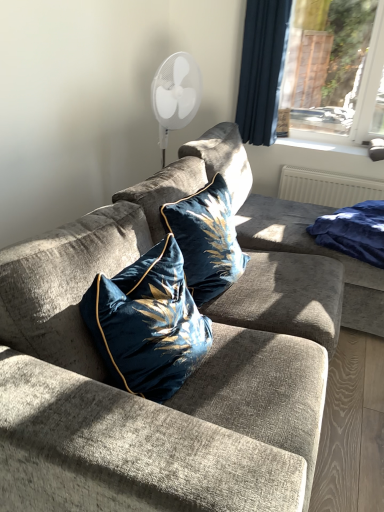
Question: Is blue velvet blanket at right shorter than velvet blue pillow at center, positioned as the 2th pillow in back-to-front order?

Choices:
 (A) no
 (B) yes

Answer: (B)

Question: Is blue velvet blanket at right positioned far away from velvet blue pillow at center, arranged as the 1th pillow when viewed from the front?

Choices:
 (A) yes
 (B) no

Answer: (A)

Question: Is blue velvet blanket at right facing away from velvet blue pillow at center, positioned as the 2th pillow in back-to-front order?

Choices:
 (A) yes
 (B) no

Answer: (B)

Question: Is blue velvet blanket at right with velvet blue pillow at center, arranged as the 1th pillow when viewed from the front?

Choices:
 (A) no
 (B) yes

Answer: (A)

Question: Considering the relative sizes of blue velvet blanket at right and velvet blue pillow at center, arranged as the 1th pillow when viewed from the front, in the image provided, is blue velvet blanket at right bigger than velvet blue pillow at center, arranged as the 1th pillow when viewed from the front,?

Choices:
 (A) no
 (B) yes

Answer: (A)

Question: From the image's perspective, does blue velvet blanket at right appear higher than velvet blue pillow at center, arranged as the 1th pillow when viewed from the front?

Choices:
 (A) no
 (B) yes

Answer: (B)

Question: Is white plastic window sill at upper right directly adjacent to velvet blue pillow at center, which is counted as the 1th pillow, starting from the back?

Choices:
 (A) yes
 (B) no

Answer: (B)

Question: Is velvet blue pillow at center, which is counted as the 1th pillow, starting from the back, completely or partially inside white plastic window sill at upper right?

Choices:
 (A) no
 (B) yes

Answer: (A)

Question: Is white plastic window sill at upper right further to the viewer compared to velvet blue pillow at center, which is the 2th pillow from front to back?

Choices:
 (A) yes
 (B) no

Answer: (A)

Question: Does white plastic window sill at upper right have a smaller size compared to velvet blue pillow at center, which is counted as the 1th pillow, starting from the back?

Choices:
 (A) no
 (B) yes

Answer: (B)

Question: Does white plastic window sill at upper right have a greater width compared to velvet blue pillow at center, which is the 2th pillow from front to back?

Choices:
 (A) no
 (B) yes

Answer: (B)

Question: Is white plastic window sill at upper right positioned before velvet blue pillow at center, which is counted as the 1th pillow, starting from the back?

Choices:
 (A) no
 (B) yes

Answer: (A)

Question: Would you say velvet fabric couch at center is a long distance from blue velvet blanket at right?

Choices:
 (A) no
 (B) yes

Answer: (A)